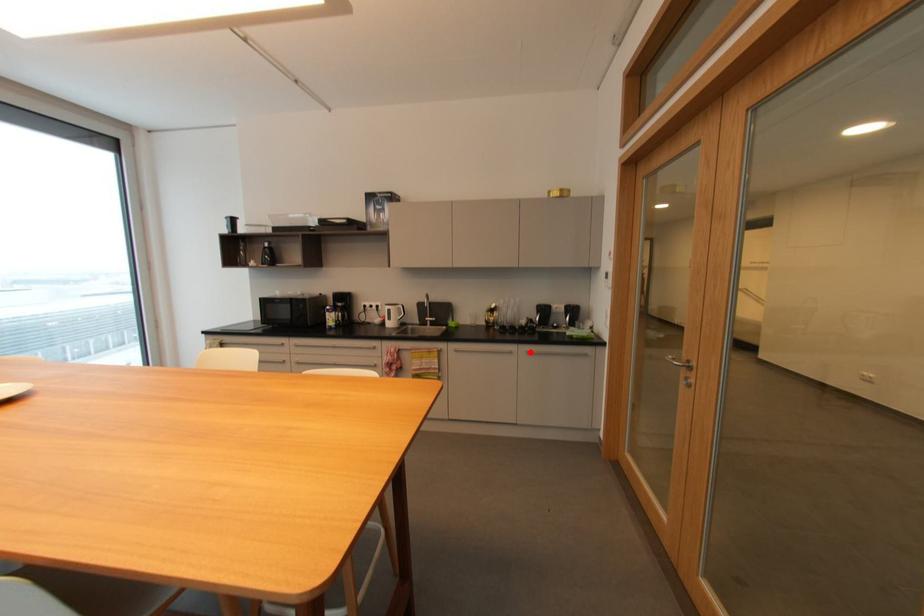
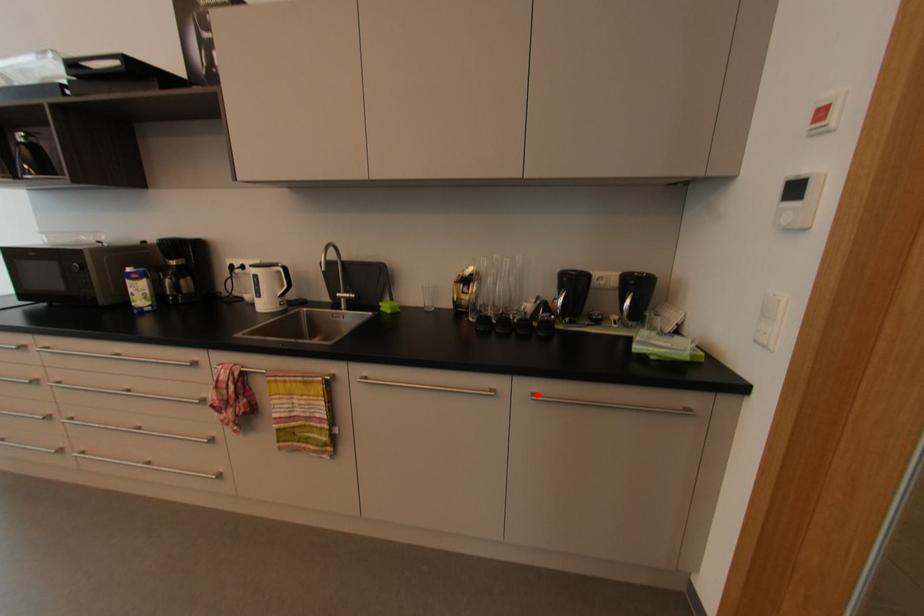
I am providing you with two images of the same scene from different viewpoints. A red point is marked on the first image and another point is marked on the second image. Are the points marked in image1 and image2 representing the same 3D position?

Yes